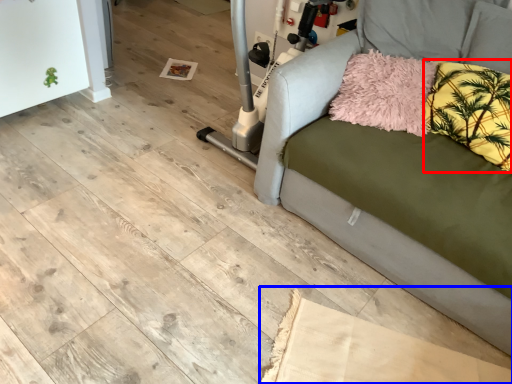
Question: Which of the following is the closest to the observer, pillow (highlighted by a red box) or cardboard (highlighted by a blue box)?

Choices:
 (A) pillow
 (B) cardboard

Answer: (B)